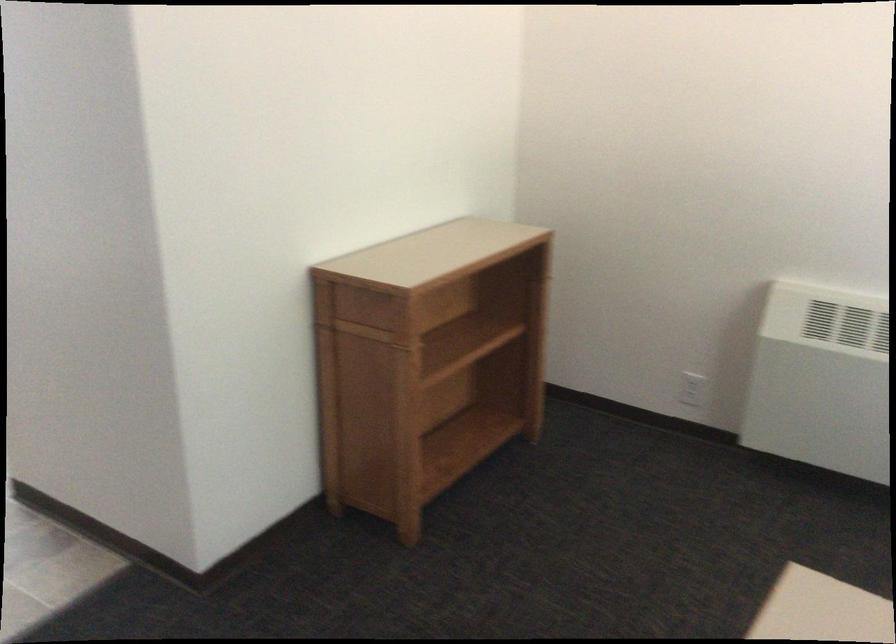
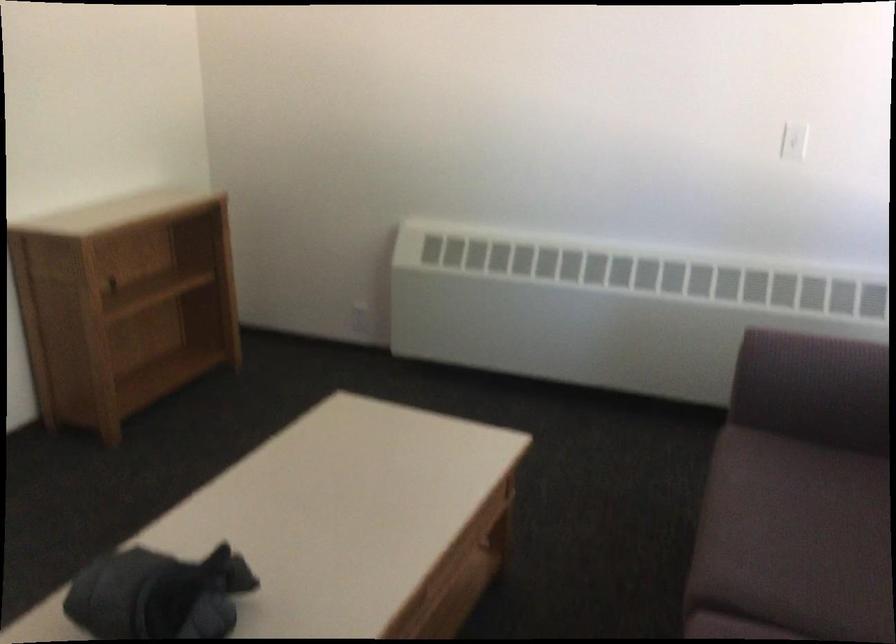
Question: How did the camera likely rotate?

Choices:
 (A) Left
 (B) Right
 (C) Up
 (D) Down

Answer: (B)